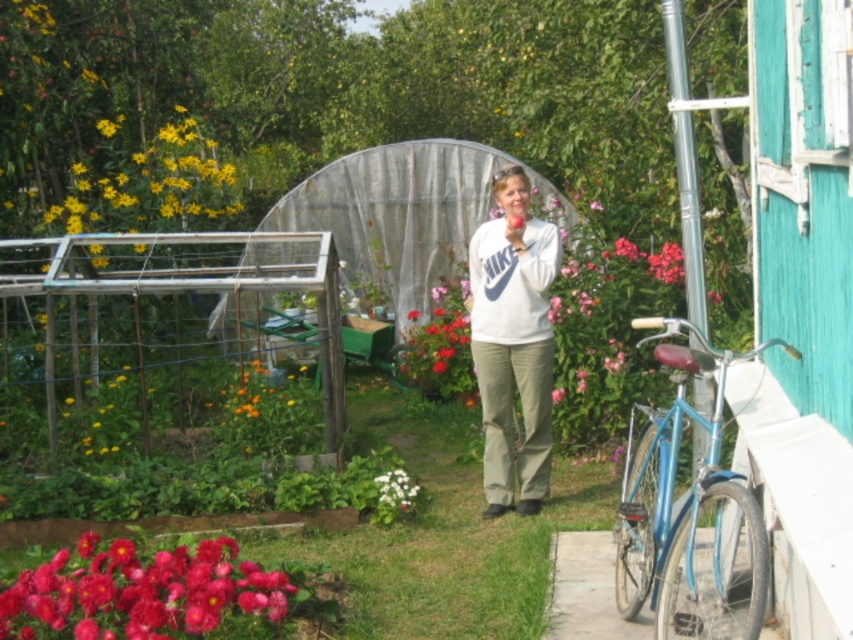
You are a photographer setting up a shot in the garden. You have to decide whether to focus on the white matte sweatshirt at center or the matte white flower at center based on their sizes. Which one should you choose if you want to capture the larger object in the frame?

The white matte sweatshirt at center has a greater height compared to the matte white flower at center, so you should focus on the white matte sweatshirt at center to capture the larger object in the frame.

You are standing in the garden and want to place a small statue between the two points, point (546,436) and point (621,312). Which point should the statue be closer to if you want it to be closer to the foreground?

The statue should be closer to point (546,436) because it is in front of point (621,312), so placing it near that point would make it closer to the foreground.

You are a photographer setting up a shot of the garden. You want to ensure the white fluffy flower at lower center is visible in the frame without being blocked by the white matte sweatshirt at center. Based on their positions, is this possible?

The white matte sweatshirt at center is located above the white fluffy flower at lower center, so if you position the camera to capture the white fluffy flower at lower center from below or adjust the angle to avoid the sweatshirt, it should be visible without obstruction.